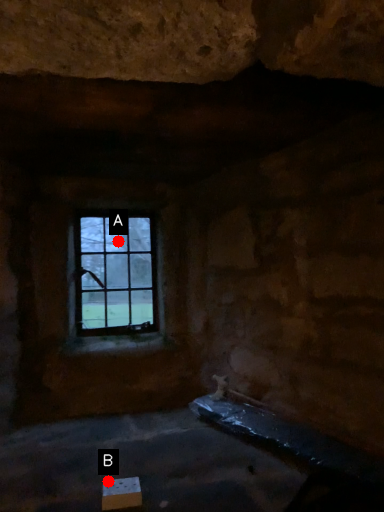
Question: Two points are circled on the image, labeled by A and B beside each circle. Among these points, which one is nearest to the camera?

Choices:
 (A) A is closer
 (B) B is closer

Answer: (B)